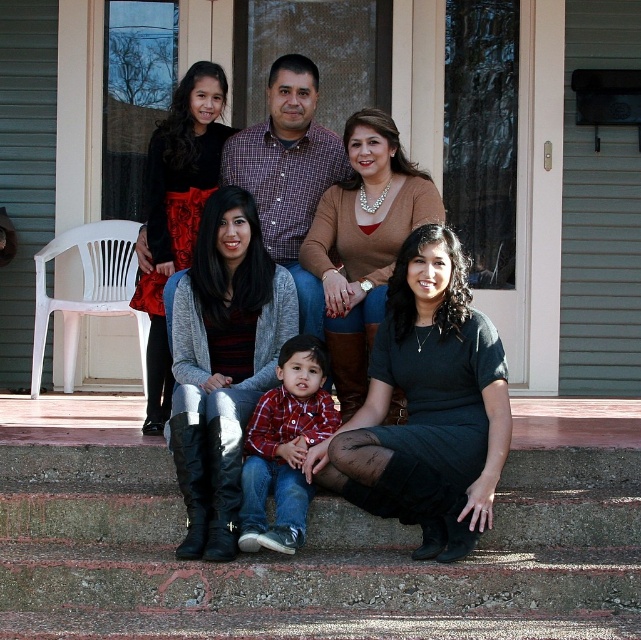
You are standing at the entrance of the house and want to reach the concrete stairs at lower center. According to the image, in which direction should you walk to reach them?

The concrete stairs at lower center are located at point (313, 556), so you should walk towards the lower center direction to reach them.

Imagine you are standing in front of the image and want to locate the matte black boots at lower left. What are their exact coordinates in the image?

The matte black boots at lower left are located at coordinates point [394,337].